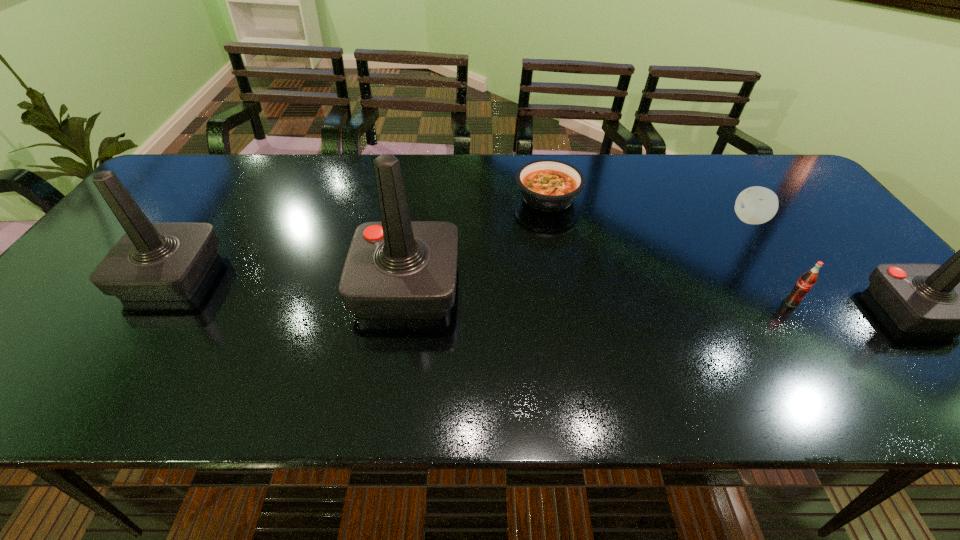
Where is `blank area located 0.210m on the left of the second shortest object`? blank area located 0.210m on the left of the second shortest object is located at coordinates [658, 220].

Identify the location of free point located on the label of the soda bottle. The height and width of the screenshot is (540, 960). (823, 352).

Where is `free point located 0.270m on the front of the shortest object`? The image size is (960, 540). free point located 0.270m on the front of the shortest object is located at coordinates (564, 290).

At what (x,y) coordinates should I click in order to perform the action: click on object present at the far edge. Please return your answer as a coordinate pair (x, y). Looking at the image, I should click on (548, 185).

The width and height of the screenshot is (960, 540). Identify the location of object that is at the left edge. (168, 261).

Find the location of a particular element. This screenshot has width=960, height=540. blank space at the far edge of the desktop is located at coordinates (619, 176).

Find the location of `vacant space at the near edge`. vacant space at the near edge is located at coordinates (200, 344).

I want to click on free region at the left edge, so click(153, 213).

In order to click on vacant space at the right edge in this screenshot , I will do `click(868, 271)`.

Identify the location of vacant point at the near left corner. (43, 338).